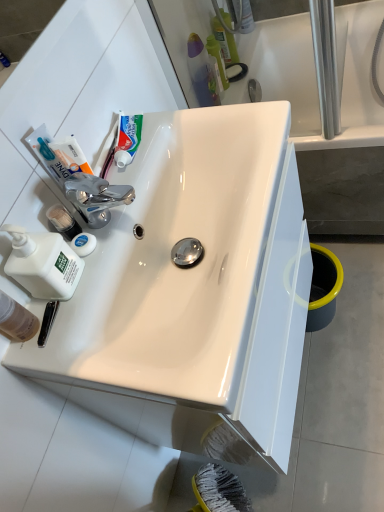
The height and width of the screenshot is (512, 384). What are the coordinates of `vacant space in front of translucent plastic mouthwash at lower left` in the screenshot? It's located at (76, 360).